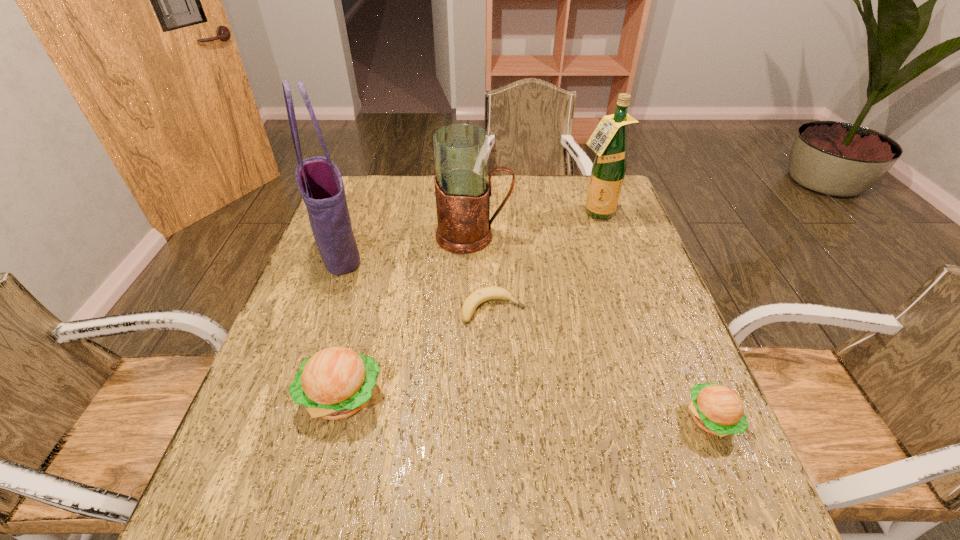
This screenshot has width=960, height=540. What are the coordinates of `vacant space that is in between the right hamburger and the liquor` in the screenshot? It's located at (654, 316).

This screenshot has width=960, height=540. I want to click on free space between the tallest object and the pitcher, so click(x=406, y=245).

Find the location of a particular element. The height and width of the screenshot is (540, 960). free space between the fourth shortest object and the left hamburger is located at coordinates (408, 316).

This screenshot has height=540, width=960. I want to click on free space between the tote bag and the fourth farthest object, so click(417, 281).

Where is `free space between the second shortest object and the pitcher`? This screenshot has width=960, height=540. free space between the second shortest object and the pitcher is located at coordinates (592, 327).

Locate an element on the screen. The height and width of the screenshot is (540, 960). object that is the fourth closest to the taller hamburger is located at coordinates (716, 409).

Locate an element on the screen. object that is the second closest to the liquor is located at coordinates (482, 295).

Find the location of a particular element. The height and width of the screenshot is (540, 960). vacant space that satisfies the following two spatial constraints: 1. on the back side of the fifth tallest object; 2. with the handle on the side of the pitcher is located at coordinates (635, 236).

The image size is (960, 540). Identify the location of free point that satisfies the following two spatial constraints: 1. on the front side of the shorter hamburger; 2. on the right side of the tallest object. (279, 419).

Find the location of a particular element. vacant space that satisfies the following two spatial constraints: 1. on the front side of the shortest object; 2. on the left side of the tote bag is located at coordinates [319, 309].